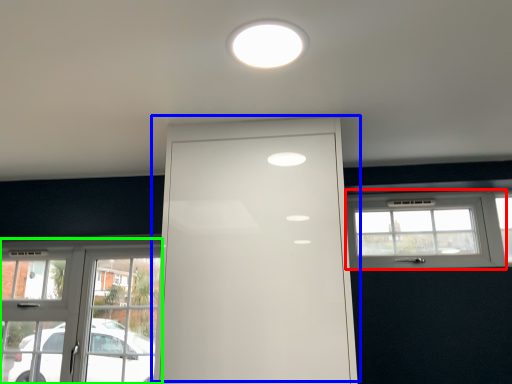
Question: Which is farther away from window (highlighted by a red box)? door (highlighted by a blue box) or window (highlighted by a green box)?

Choices:
 (A) door
 (B) window

Answer: (B)